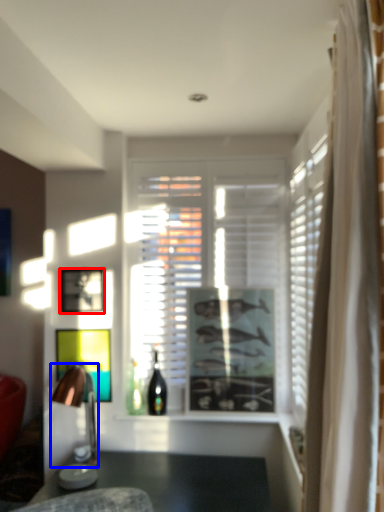
Question: Which of the following is the closest to the observer, picture frame (highlighted by a red box) or lamp (highlighted by a blue box)?

Choices:
 (A) picture frame
 (B) lamp

Answer: (B)